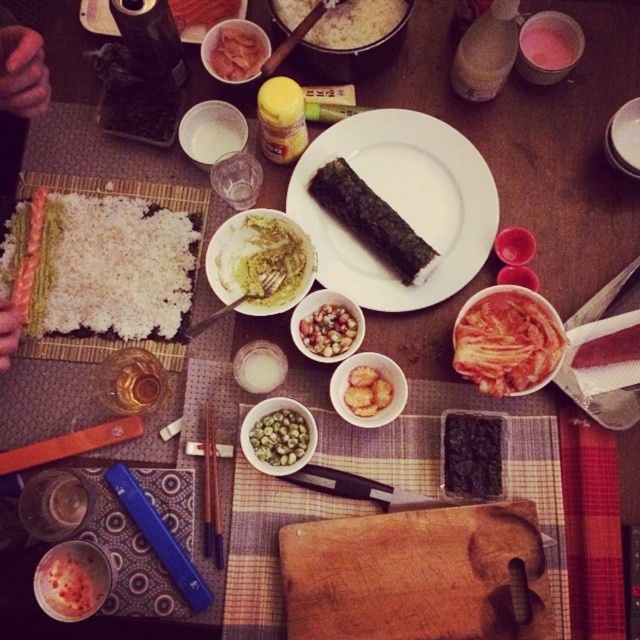
You are a photographer standing at a certain distance from the green matte rice ball at center. If you want to take a closeup shot of it, should you move closer or farther away?

The green matte rice ball at center is 76.02 centimeters away from the camera. To take a closeup shot, you should move closer to reduce the distance between yourself and the rice ball.

Please provide the exact coordinates of the green matte peas at center in the image coordinate system where the origin is at the bottom left corner. The coordinates should be in the format of a tuple with two decimal numbers separated by a comma, such as 0.5,0.5.

The exact coordinates of the green matte peas at center are (280, 436).